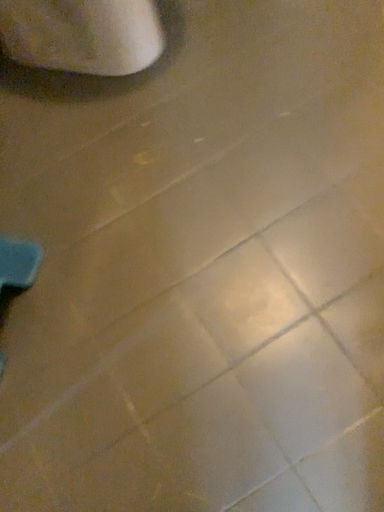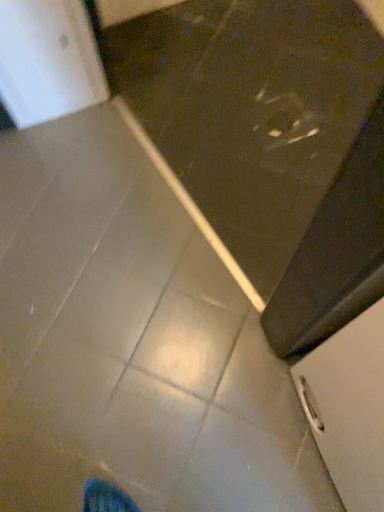
Question: Which way did the camera rotate in the video?

Choices:
 (A) rotated downward
 (B) rotated upward

Answer: (B)